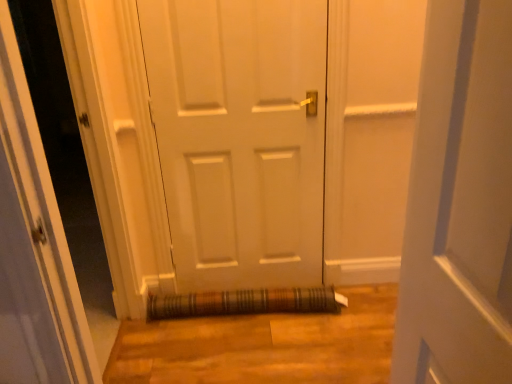
Question: Considering the relative sizes of white matte door at center and brown woven mat at lower center in the image provided, is white matte door at center bigger than brown woven mat at lower center?

Choices:
 (A) yes
 (B) no

Answer: (A)

Question: From the image's perspective, would you say white matte door at center is positioned over brown woven mat at lower center?

Choices:
 (A) yes
 (B) no

Answer: (A)

Question: From a real-world perspective, is white matte door at center on brown woven mat at lower center?

Choices:
 (A) yes
 (B) no

Answer: (A)

Question: Is the surface of white matte door at center in direct contact with brown woven mat at lower center?

Choices:
 (A) no
 (B) yes

Answer: (A)

Question: Is white matte door at center positioned beyond the bounds of brown woven mat at lower center?

Choices:
 (A) yes
 (B) no

Answer: (A)

Question: Is white matte door at center to the left of brown woven mat at lower center from the viewer's perspective?

Choices:
 (A) no
 (B) yes

Answer: (B)

Question: Is brown woven mat at lower center bigger than transparent glass door at center?

Choices:
 (A) yes
 (B) no

Answer: (B)

Question: From the image's perspective, is brown woven mat at lower center located above transparent glass door at center?

Choices:
 (A) no
 (B) yes

Answer: (A)

Question: Is brown woven mat at lower center completely or partially outside of transparent glass door at center?

Choices:
 (A) no
 (B) yes

Answer: (B)

Question: Considering the relative sizes of brown woven mat at lower center and transparent glass door at center in the image provided, is brown woven mat at lower center shorter than transparent glass door at center?

Choices:
 (A) no
 (B) yes

Answer: (B)

Question: Can you confirm if brown woven mat at lower center is positioned to the right of transparent glass door at center?

Choices:
 (A) yes
 (B) no

Answer: (A)

Question: Is brown woven mat at lower center smaller than transparent glass door at center?

Choices:
 (A) no
 (B) yes

Answer: (B)

Question: Is the depth of white matte door at center greater than that of transparent glass door at center?

Choices:
 (A) yes
 (B) no

Answer: (A)